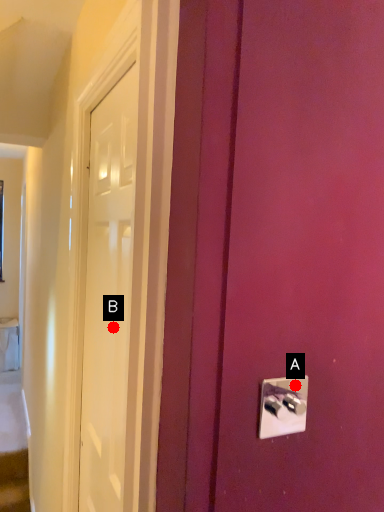
Question: Two points are circled on the image, labeled by A and B beside each circle. Which point is closer to the camera taking this photo?

Choices:
 (A) A is closer
 (B) B is closer

Answer: (A)